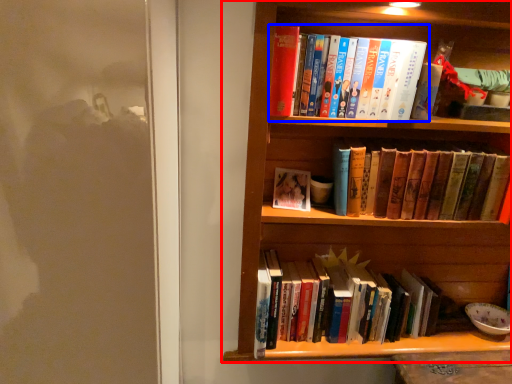
Question: Which object is closer to the camera taking this photo, bookcase (highlighted by a red box) or book (highlighted by a blue box)?

Choices:
 (A) bookcase
 (B) book

Answer: (A)